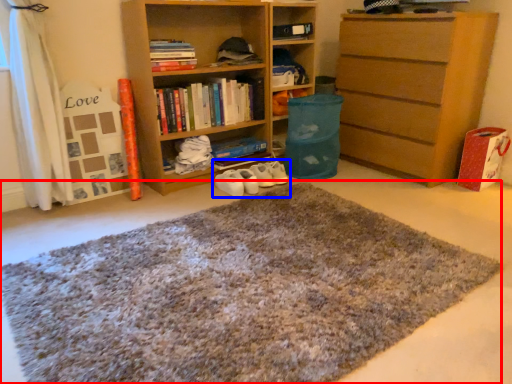
Question: Which object is closer to the camera taking this photo, doormat (highlighted by a red box) or footwear (highlighted by a blue box)?

Choices:
 (A) doormat
 (B) footwear

Answer: (A)